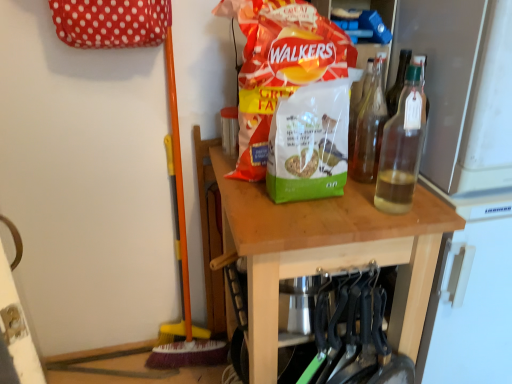
I want to click on vacant space to the left of green matte birdseed bag at center, which is the second waste in top-to-bottom order, so click(x=244, y=197).